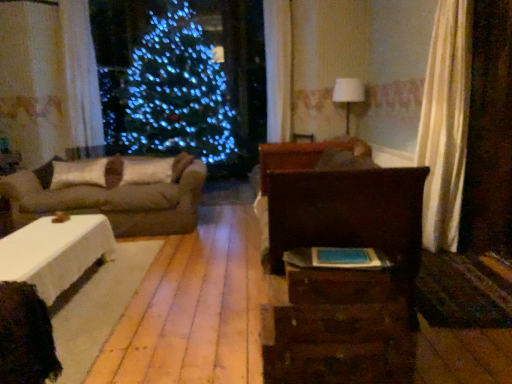
You are a GUI agent. You are given a task and a screenshot of the screen. Output one action in this format:
    pyautogui.click(x=<x>, y=<y>)
    Task: Click on the rustic wood dresser at center
    The width and height of the screenshot is (512, 384).
    Given the screenshot: What is the action you would take?
    pyautogui.click(x=339, y=325)

Describe the element at coordinates (78, 173) in the screenshot. The height and width of the screenshot is (384, 512). I see `white matte pillow at left, which ranks as the first pillow in left-to-right order` at that location.

What do you see at coordinates (81, 75) in the screenshot?
I see `white sheer curtain at upper left` at bounding box center [81, 75].

Find the location of a particular element. This screenshot has width=512, height=384. rustic wood dresser at center is located at coordinates (339, 325).

In the scene shown: Is white sheer curtain at upper left positioned far away from dark wood bed at center?

Indeed, white sheer curtain at upper left is not near dark wood bed at center.

Between white sheer curtain at upper left and dark wood bed at center, which one has larger size?

With larger size is dark wood bed at center.

Which object is thinner, white sheer curtain at upper left or dark wood bed at center?

With smaller width is white sheer curtain at upper left.

Considering the relative positions of white sheer curtain at upper left and dark wood bed at center in the image provided, is white sheer curtain at upper left behind dark wood bed at center?

That is True.

From the image's perspective, is rustic wood dresser at center on top of dark wood bed at center?

No, from the image's perspective, rustic wood dresser at center is not above dark wood bed at center.

Considering the sizes of objects rustic wood dresser at center and dark wood bed at center in the image provided, who is wider, rustic wood dresser at center or dark wood bed at center?

With larger width is dark wood bed at center.

Does point (301, 350) lie behind point (399, 228)?

No, (301, 350) is closer to viewer.

In the scene shown: Is rustic wood dresser at center positioned before dark wood bed at center?

That is True.

Is white fabric pillow at left, the 1th pillow positioned from the right, touching white sheer curtain at upper left?

No, white fabric pillow at left, the 1th pillow positioned from the right, is not touching white sheer curtain at upper left.

Can you confirm if white fabric pillow at left, which is the second pillow from left to right, is wider than white sheer curtain at upper left?

Yes, white fabric pillow at left, which is the second pillow from left to right, is wider than white sheer curtain at upper left.

Considering the positions of objects white fabric pillow at left, which is the second pillow from left to right, and white sheer curtain at upper left in the image provided, who is more to the right, white fabric pillow at left, which is the second pillow from left to right, or white sheer curtain at upper left?

white fabric pillow at left, which is the second pillow from left to right, is more to the right.

Is white fabric pillow at left, which is the second pillow from left to right, taller or shorter than white sheer curtain at upper left?

In the image, white fabric pillow at left, which is the second pillow from left to right, appears to be shorter than white sheer curtain at upper left.

Considering the relative sizes of white fabric pillow at left, which is the second pillow from left to right, and white matte pillow at left, which ranks as the first pillow in left-to-right order, in the image provided, is white fabric pillow at left, which is the second pillow from left to right, bigger than white matte pillow at left, which ranks as the first pillow in left-to-right order,?

Incorrect, white fabric pillow at left, which is the second pillow from left to right, is not larger than white matte pillow at left, which ranks as the first pillow in left-to-right order.

Is white fabric pillow at left, the 1th pillow positioned from the right, to the left of white matte pillow at left, which is the 2th pillow from right to left, from the viewer's perspective?

No, white fabric pillow at left, the 1th pillow positioned from the right, is not to the left of white matte pillow at left, which is the 2th pillow from right to left.

Is white fabric pillow at left, the 1th pillow positioned from the right, positioned with its back to white matte pillow at left, which ranks as the first pillow in left-to-right order?

white fabric pillow at left, the 1th pillow positioned from the right, is not turned away from white matte pillow at left, which ranks as the first pillow in left-to-right order.

Which point is more distant from viewer, (165, 167) or (60, 176)?

The point (165, 167) is behind.

Is white matte pillow at left, which ranks as the first pillow in left-to-right order, at the right side of dark wood bed at center?

No, white matte pillow at left, which ranks as the first pillow in left-to-right order, is not to the right of dark wood bed at center.

Is dark wood bed at center completely or partially inside white matte pillow at left, which is the 2th pillow from right to left?

No.

Does white matte pillow at left, which is the 2th pillow from right to left, have a greater width compared to dark wood bed at center?

No, white matte pillow at left, which is the 2th pillow from right to left, is not wider than dark wood bed at center.

Is white fabric pillow at left, the 1th pillow positioned from the right, surrounded by white matte pillow at left, which ranks as the first pillow in left-to-right order?

No, white fabric pillow at left, the 1th pillow positioned from the right, is not inside white matte pillow at left, which ranks as the first pillow in left-to-right order.

From the image's perspective, between white matte pillow at left, which is the 2th pillow from right to left, and white fabric pillow at left, the 1th pillow positioned from the right, which one is located above?

white fabric pillow at left, the 1th pillow positioned from the right, is shown above in the image.

Considering the relative positions of white matte pillow at left, which is the 2th pillow from right to left, and white fabric pillow at left, which is the second pillow from left to right, in the image provided, is white matte pillow at left, which is the 2th pillow from right to left, to the right of white fabric pillow at left, which is the second pillow from left to right, from the viewer's perspective?

In fact, white matte pillow at left, which is the 2th pillow from right to left, is to the left of white fabric pillow at left, which is the second pillow from left to right.

Is white matte pillow at left, which is the 2th pillow from right to left, in contact with white fabric pillow at left, which is the second pillow from left to right?

No, white matte pillow at left, which is the 2th pillow from right to left, is not touching white fabric pillow at left, which is the second pillow from left to right.

Is rustic wood dresser at center with wooden drawer at lower right?

Yes, the surface of rustic wood dresser at center is in contact with wooden drawer at lower right.

Is the position of rustic wood dresser at center more distant than that of wooden drawer at lower right?

No, rustic wood dresser at center is in front of wooden drawer at lower right.

Does rustic wood dresser at center turn towards wooden drawer at lower right?

No, rustic wood dresser at center is not facing towards wooden drawer at lower right.

Is wooden drawer at lower right located within rustic wood dresser at center?

Definitely not — wooden drawer at lower right is not inside rustic wood dresser at center.

Identify the location of curtain above the dark wood bed at center (from a real-world perspective). (81, 75).

Locate an element on the screen. dresser in front of the dark wood bed at center is located at coordinates (339, 325).

Considering their positions, is beige fabric couch at left positioned further to white fabric lampshade at upper center than wooden drawer at lower right?

wooden drawer at lower right is positioned further to the anchor white fabric lampshade at upper center.

When comparing their distances from white sheer curtain at upper left, does white matte pillow at left, which ranks as the first pillow in left-to-right order, or dark wood bed at center seem further?

Based on the image, dark wood bed at center appears to be further to white sheer curtain at upper left.

Estimate the real-world distances between objects in this image. Which object is closer to dark wood bed at center, rustic wood dresser at center or white matte pillow at left, which is the 2th pillow from right to left?

rustic wood dresser at center is closer to dark wood bed at center.

Estimate the real-world distances between objects in this image. Which object is further from white matte pillow at left, which ranks as the first pillow in left-to-right order, wooden drawer at lower right or dark wood bed at center?

wooden drawer at lower right lies further to white matte pillow at left, which ranks as the first pillow in left-to-right order, than the other object.

Based on the photo, looking at the image, which one is located further to rustic wood dresser at center, white matte pillow at left, which is the 2th pillow from right to left, or wooden drawer at lower right?

Based on the image, white matte pillow at left, which is the 2th pillow from right to left, appears to be further to rustic wood dresser at center.

Considering their positions, is dark wood bed at center positioned further to white matte pillow at left, which ranks as the first pillow in left-to-right order, than wooden drawer at lower right?

Among the two, wooden drawer at lower right is located further to white matte pillow at left, which ranks as the first pillow in left-to-right order.

Looking at the image, which one is located closer to white sheer curtain at upper left, dark wood bed at center or wooden drawer at lower right?

The object closer to white sheer curtain at upper left is dark wood bed at center.

Looking at the image, which one is located closer to white fabric pillow at left, the 1th pillow positioned from the right, dark wood bed at center or rustic wood dresser at center?

Among the two, dark wood bed at center is located nearer to white fabric pillow at left, the 1th pillow positioned from the right.

You are a GUI agent. You are given a task and a screenshot of the screen. Output one action in this format:
    pyautogui.click(x=<x>, y=<y>)
    Task: Click on the studio couch between rustic wood dresser at center and white sheer curtain at upper left along the z-axis
    The image size is (512, 384).
    Given the screenshot: What is the action you would take?
    pyautogui.click(x=114, y=202)

You are a GUI agent. You are given a task and a screenshot of the screen. Output one action in this format:
    pyautogui.click(x=<x>, y=<y>)
    Task: Click on the studio couch between dark wood bed at center and white fabric lampshade at upper center in the front-back direction
    The image size is (512, 384).
    Given the screenshot: What is the action you would take?
    pyautogui.click(x=114, y=202)

Locate an element on the screen. This screenshot has height=384, width=512. studio couch between wooden drawer at lower right and white fabric pillow at left, the 1th pillow positioned from the right, from front to back is located at coordinates (114, 202).

I want to click on studio couch between wooden drawer at lower right and white matte pillow at left, which is the 2th pillow from right to left, from front to back, so click(x=114, y=202).